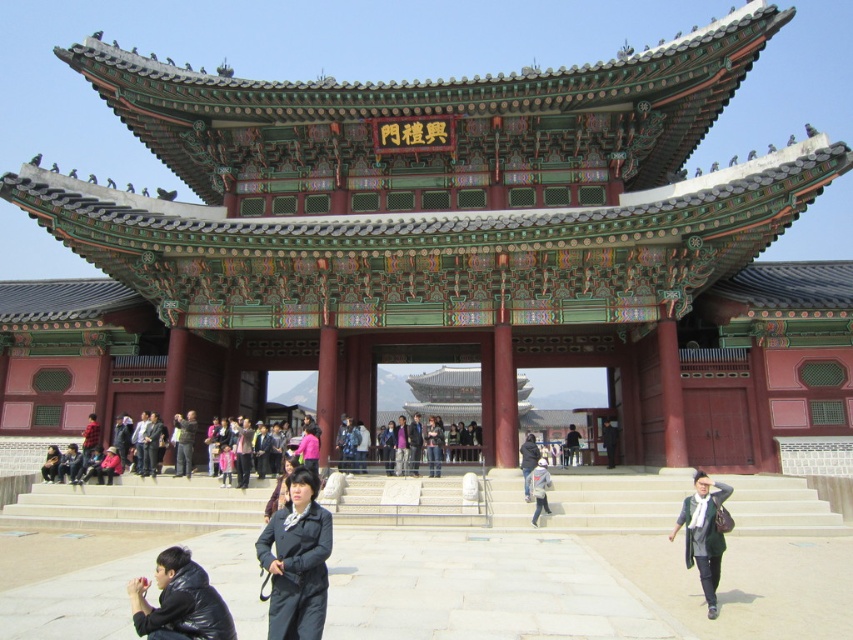
Which is above, black matte coat at center or black leather jacket at lower left?

Positioned higher is black leather jacket at lower left.

What do you see at coordinates (296, 561) in the screenshot? The height and width of the screenshot is (640, 853). I see `black matte coat at center` at bounding box center [296, 561].

Between point (317, 541) and point (142, 577), which one is positioned in front?

Point (317, 541)

I want to click on black matte coat at center, so [x=296, y=561].

Locate an element on the screen. This screenshot has width=853, height=640. black leather jacket at lower left is located at coordinates (178, 602).

Who is more distant from viewer, [161,618] or [415,420]?

The point [415,420] is more distant.

Measure the distance between point (198,564) and camera.

23.93 meters

This screenshot has height=640, width=853. What are the coordinates of `black leather jacket at lower left` in the screenshot? It's located at (178, 602).

Does dark blue fabric jacket at center appear on the left side of purple fabric jacket at center?

Incorrect, dark blue fabric jacket at center is not on the left side of purple fabric jacket at center.

At what (x,y) coordinates should I click in order to perform the action: click on dark blue fabric jacket at center. Please return your answer as a coordinate pair (x, y). The height and width of the screenshot is (640, 853). Looking at the image, I should click on (415, 444).